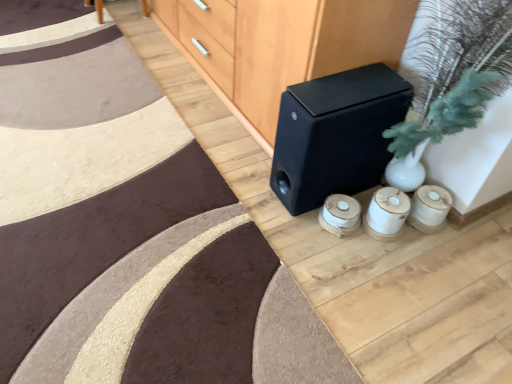
Question: Considering the relative sizes of black matte speaker at center and black matte speaker at center in the image provided, is black matte speaker at center shorter than black matte speaker at center?

Choices:
 (A) yes
 (B) no

Answer: (B)

Question: Can you confirm if black matte speaker at center is bigger than black matte speaker at center?

Choices:
 (A) yes
 (B) no

Answer: (A)

Question: Is black matte speaker at center positioned in front of black matte speaker at center?

Choices:
 (A) no
 (B) yes

Answer: (B)

Question: Are black matte speaker at center and black matte speaker at center located far from each other?

Choices:
 (A) yes
 (B) no

Answer: (B)

Question: Is black matte speaker at center oriented towards black matte speaker at center?

Choices:
 (A) yes
 (B) no

Answer: (B)

Question: Is black matte speaker at center taller than black matte speaker at center?

Choices:
 (A) yes
 (B) no

Answer: (A)

Question: Is black matte speaker at center directly adjacent to black matte speaker at center?

Choices:
 (A) yes
 (B) no

Answer: (B)

Question: Can you confirm if black matte speaker at center is shorter than black matte speaker at center?

Choices:
 (A) yes
 (B) no

Answer: (A)

Question: Is black matte speaker at center looking in the opposite direction of black matte speaker at center?

Choices:
 (A) yes
 (B) no

Answer: (B)

Question: Is black matte speaker at center at the right side of black matte speaker at center?

Choices:
 (A) no
 (B) yes

Answer: (B)

Question: Considering the relative positions of black matte speaker at center and black matte speaker at center in the image provided, is black matte speaker at center in front of black matte speaker at center?

Choices:
 (A) yes
 (B) no

Answer: (B)

Question: From the image's perspective, is black matte speaker at center located above black matte speaker at center?

Choices:
 (A) no
 (B) yes

Answer: (A)

Question: From their relative heights in the image, would you say black matte speaker at center is taller or shorter than black matte speaker at center?

Choices:
 (A) tall
 (B) short

Answer: (A)